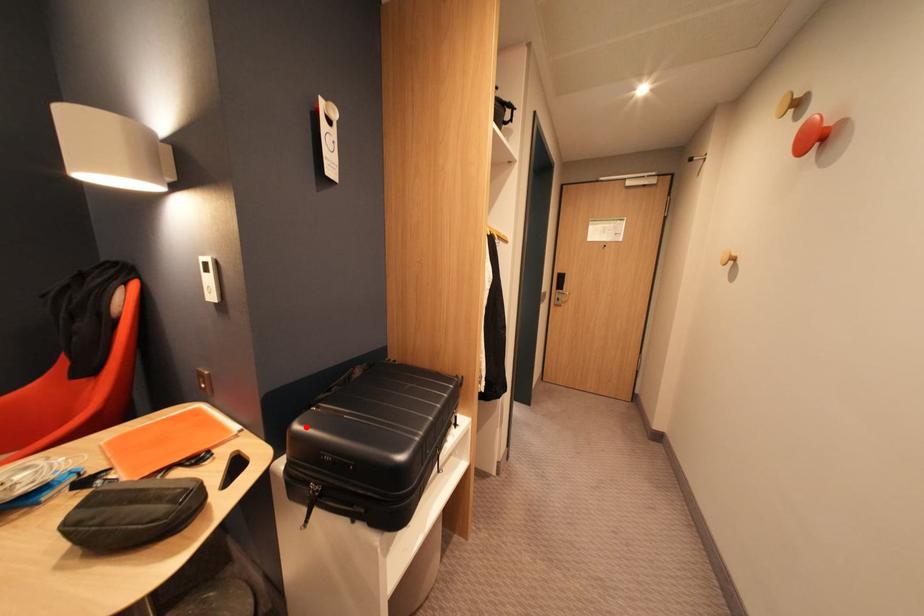
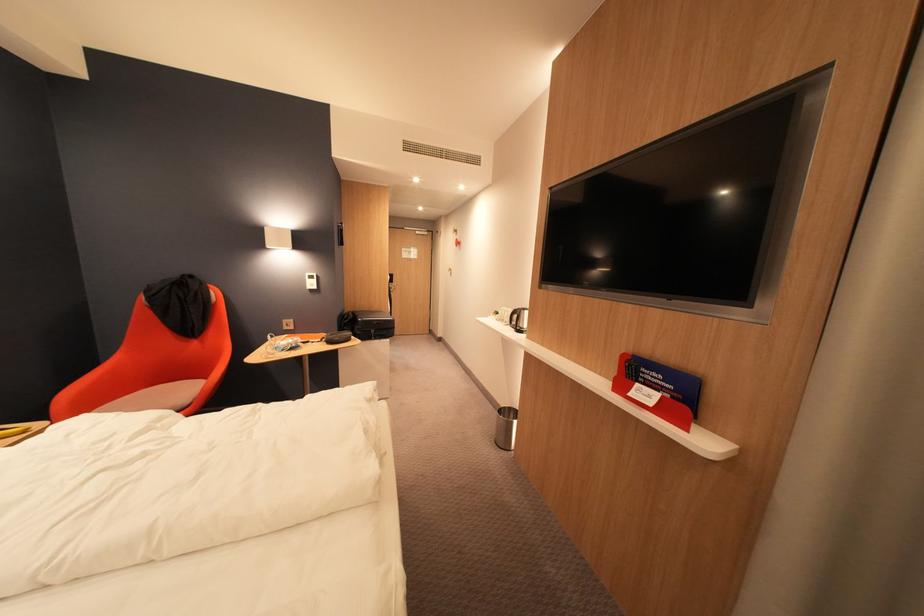
Find the pixel in the second image that matches the highlighted location in the first image.

(370, 321)